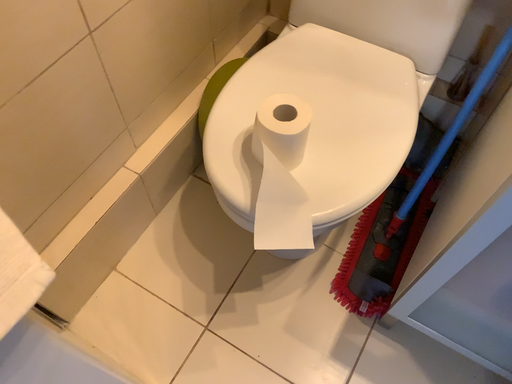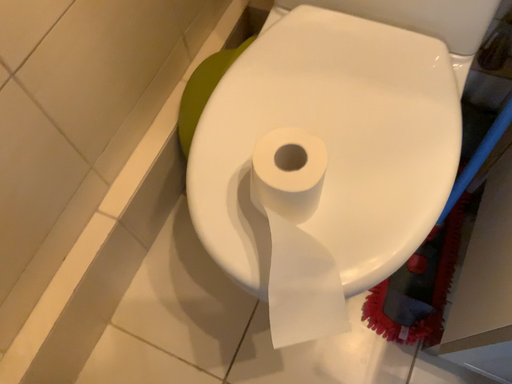
Question: How did the camera likely rotate when shooting the video?

Choices:
 (A) rotated upward
 (B) rotated downward

Answer: (B)